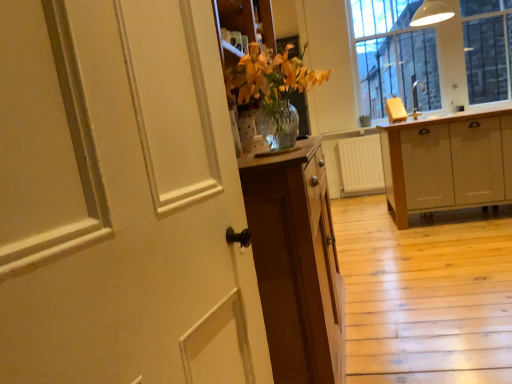
At what (x,y) coordinates should I click in order to perform the action: click on matte silver faucet at upper right. Please return your answer as a coordinate pair (x, y). The height and width of the screenshot is (384, 512). Looking at the image, I should click on point(403,105).

What is the approximate width of white painted wood door at left?

It is 3.64 inches.

The width and height of the screenshot is (512, 384). I want to click on clear glass window at upper right, so click(x=433, y=54).

Locate an element on the screen. Image resolution: width=512 pixels, height=384 pixels. door on the left of matte silver faucet at upper right is located at coordinates (119, 198).

From the image's perspective, is white painted wood door at left above matte silver faucet at upper right?

No, from the image's perspective, white painted wood door at left is not over matte silver faucet at upper right.

Which of these two, white painted wood door at left or matte silver faucet at upper right, is bigger?

With larger size is white painted wood door at left.

Can you tell me how much white painted wood door at left and matte silver faucet at upper right differ in facing direction?

The angular difference between white painted wood door at left and matte silver faucet at upper right is 52.2 degrees.

Identify the location of door below the matte silver faucet at upper right (from the image's perspective). The image size is (512, 384). (119, 198).

From the picture: Between matte silver faucet at upper right and white painted wood door at left, which one has smaller size?

Smaller between the two is matte silver faucet at upper right.

From a real-world perspective, is matte silver faucet at upper right positioned over white painted wood door at left based on gravity?

Indeed, from a real-world perspective, matte silver faucet at upper right stands above white painted wood door at left.

Is matte silver faucet at upper right taller than white painted wood door at left?

Incorrect, the height of matte silver faucet at upper right is not larger of that of white painted wood door at left.

From a real-world perspective, between white painted wood door at left and light wood cabinet at right, who is vertically higher?

white painted wood door at left.

Can you confirm if white painted wood door at left is positioned to the left of light wood cabinet at right?

Indeed, white painted wood door at left is positioned on the left side of light wood cabinet at right.

Is white painted wood door at left oriented towards light wood cabinet at right?

No, white painted wood door at left is not facing towards light wood cabinet at right.

Which is behind, point (481, 135) or point (484, 73)?

Positioned behind is point (484, 73).

Between light wood cabinet at right and clear glass window at upper right, which one has larger width?

light wood cabinet at right.

Is light wood cabinet at right with clear glass window at upper right?

No.

Which of these two, light wood cabinet at right or clear glass window at upper right, stands shorter?

Standing shorter between the two is light wood cabinet at right.

From the image's perspective, is light wood cabinet at right on top of white painted wood door at left?

Yes, from the image's perspective, light wood cabinet at right is over white painted wood door at left.

Considering the positions of objects light wood cabinet at right and white painted wood door at left in the image provided, who is more to the right, light wood cabinet at right or white painted wood door at left?

light wood cabinet at right is more to the right.

What's the angular difference between light wood cabinet at right and white painted wood door at left's facing directions?

The angular difference between light wood cabinet at right and white painted wood door at left is 78.5 degrees.

Is white painted wood door at left located within light wood cabinet at right?

No.

In the scene shown: Could you tell me if matte silver faucet at upper right is turned towards clear glass window at upper right?

No, matte silver faucet at upper right does not turn towards clear glass window at upper right.

How distant is matte silver faucet at upper right from clear glass window at upper right?

matte silver faucet at upper right and clear glass window at upper right are 17.14 inches apart.

Considering the sizes of objects matte silver faucet at upper right and clear glass window at upper right in the image provided, who is bigger, matte silver faucet at upper right or clear glass window at upper right?

clear glass window at upper right.

From a real-world perspective, between matte silver faucet at upper right and clear glass window at upper right, who is vertically lower?

matte silver faucet at upper right, from a real-world perspective.

Can you see light wood cabinet at right touching matte silver faucet at upper right?

No.

Where is `sink behind the light wood cabinet at right`? sink behind the light wood cabinet at right is located at coordinates (403, 105).

How many degrees apart are the facing directions of light wood cabinet at right and matte silver faucet at upper right?

The angular difference between light wood cabinet at right and matte silver faucet at upper right is 131 degrees.

Can you confirm if light wood cabinet at right is wider than matte silver faucet at upper right?

Yes.

The height and width of the screenshot is (384, 512). I want to click on sink on the right of white painted wood door at left, so click(403, 105).

The height and width of the screenshot is (384, 512). Find the location of `sink behind the white painted wood door at left`. sink behind the white painted wood door at left is located at coordinates (403, 105).

Considering their positions, is white painted wood door at left positioned closer to clear glass window at upper right than matte silver faucet at upper right?

matte silver faucet at upper right is positioned closer to the anchor clear glass window at upper right.

Considering their positions, is white painted wood door at left positioned closer to matte silver faucet at upper right than light wood cabinet at right?

Among the two, light wood cabinet at right is located nearer to matte silver faucet at upper right.

Considering their positions, is white painted wood door at left positioned further to light wood cabinet at right than clear glass window at upper right?

white painted wood door at left.

Which object lies further to the anchor point clear glass window at upper right, light wood cabinet at right or white painted wood door at left?

white painted wood door at left is positioned further to the anchor clear glass window at upper right.

Looking at the image, which one is located closer to matte silver faucet at upper right, clear glass window at upper right or light wood cabinet at right?

clear glass window at upper right lies closer to matte silver faucet at upper right than the other object.

Based on their spatial positions, is clear glass window at upper right or white painted wood door at left closer to light wood cabinet at right?

The object closer to light wood cabinet at right is clear glass window at upper right.

Which object lies nearer to the anchor point light wood cabinet at right, clear glass window at upper right or matte silver faucet at upper right?

The object closer to light wood cabinet at right is matte silver faucet at upper right.

Based on their spatial positions, is clear glass window at upper right or matte silver faucet at upper right closer to white painted wood door at left?

matte silver faucet at upper right.

Locate an element on the screen. cabinetry between white painted wood door at left and clear glass window at upper right from front to back is located at coordinates (447, 162).

Identify the location of sink between white painted wood door at left and clear glass window at upper right in the front-back direction. The height and width of the screenshot is (384, 512). click(403, 105).

Find the location of `cabinetry located between white painted wood door at left and matte silver faucet at upper right in the depth direction`. cabinetry located between white painted wood door at left and matte silver faucet at upper right in the depth direction is located at coordinates (447, 162).

Where is `sink positioned between light wood cabinet at right and clear glass window at upper right from near to far`? The width and height of the screenshot is (512, 384). sink positioned between light wood cabinet at right and clear glass window at upper right from near to far is located at coordinates (403, 105).